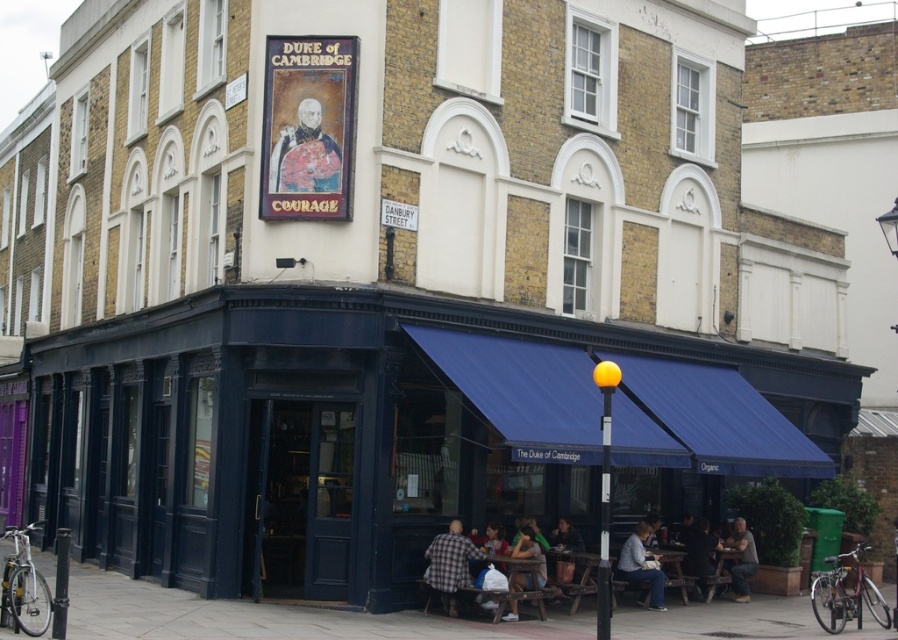
Question: Is matte gray jacket at lower center wider than dark blue shirt at lower right?

Choices:
 (A) no
 (B) yes

Answer: (A)

Question: Does checkered fabric shirt at lower center have a larger size compared to light gray sweater at lower center?

Choices:
 (A) no
 (B) yes

Answer: (A)

Question: Which object appears closest to the camera in this image?

Choices:
 (A) dark blue shirt at lower right
 (B) matte gold portrait at upper center
 (C) light gray sweater at lower center
 (D) brown leather jacket at lower right

Answer: (B)

Question: Which object appears farthest from the camera in this image?

Choices:
 (A) light gray sweater at lower center
 (B) matte gold portrait at upper center
 (C) checkered fabric shirt at lower center
 (D) brown leather jacket at lower right

Answer: (D)

Question: Which point appears closest to the camera in this image?

Choices:
 (A) (310, 180)
 (B) (525, 582)
 (C) (750, 541)

Answer: (A)

Question: In this image, where is dark blue shirt at lower right located relative to brown leather jacket at lower right?

Choices:
 (A) right
 (B) left

Answer: (B)